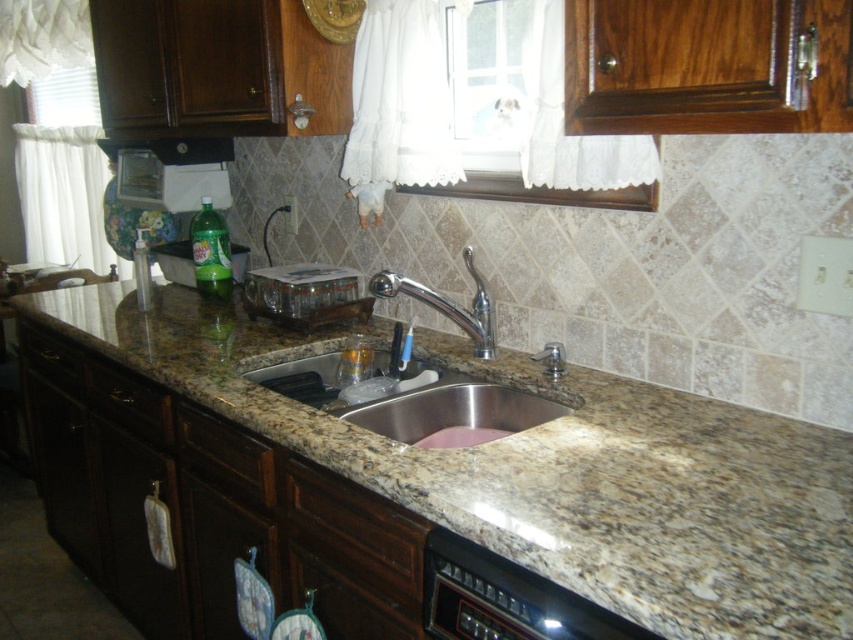
You are a delivery robot holding a package that needs to be placed at the point labeled as point (606, 548). The robot has a height of 36 inches. Can the robot safely place the package at that point without hitting its head?

The distance of point (606, 548) from camera is 36.67 inches. Since the robot is 36 inches tall, it can safely place the package at that point as the height is sufficient.

You are organizing items on the kitchen counter and see the granite at center and the green plastic bottle at center. Which item is located to the right of the other?

The granite at center is positioned on the right side of green plastic bottle at center, so the granite at center is to the right of the green plastic bottle at center.